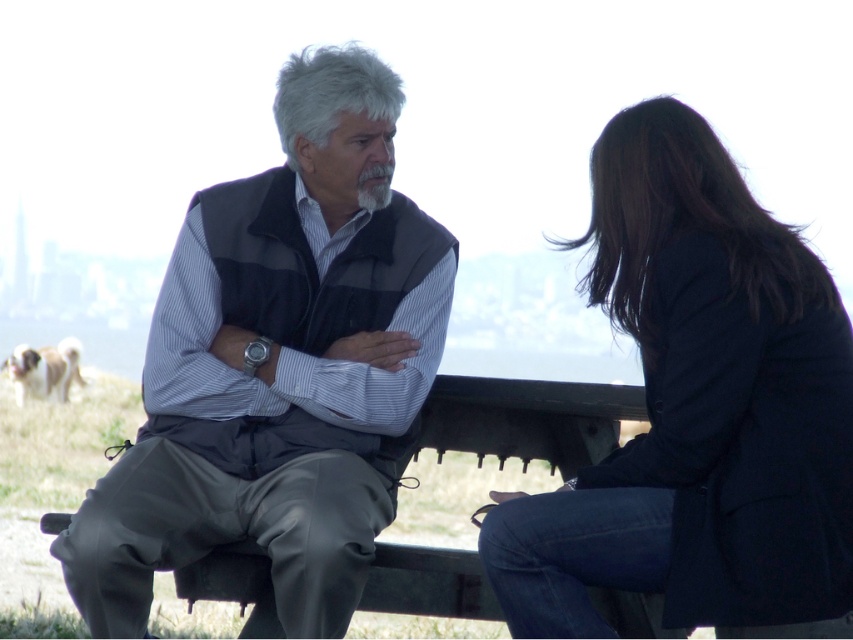
In the scene shown: You are a tailor measuring clothes for two customers. The dark blue blazer at right and the fluffy beige dog at lower left are both in front of you. Which item requires a wider measurement for its width?

The fluffy beige dog at lower left requires a wider measurement because the dark blue blazer at right is narrower than the fluffy beige dog at lower left.

You are designing a new coat rack that needs to accommodate both the gray fabric vest at center and the fluffy beige dog at lower left. Based on their sizes, which item requires a wider hanger?

The fluffy beige dog at lower left requires a wider hanger because its width is greater than the gray fabric vest at center.